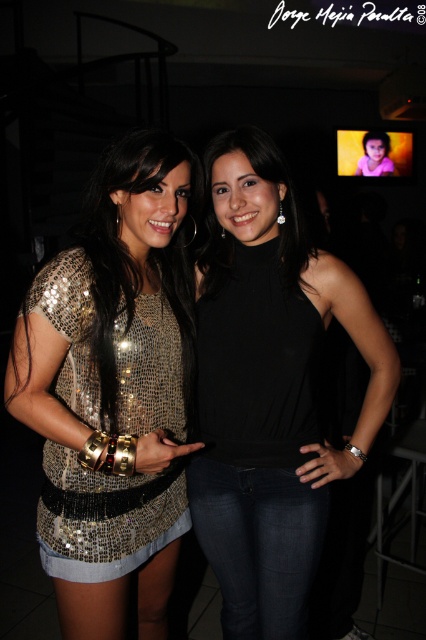
How distant is sequined metallic dress at left from sequined gold dress at center?

sequined metallic dress at left and sequined gold dress at center are 13.87 centimeters apart from each other.

Locate an element on the screen. The image size is (426, 640). sequined metallic dress at left is located at coordinates (104, 516).

Where is `sequined metallic dress at left`? This screenshot has width=426, height=640. sequined metallic dress at left is located at coordinates (104, 516).

Measure the distance between black matte tank top at center and camera.

black matte tank top at center is 4.15 feet away from camera.

Is the position of black matte tank top at center more distant than that of sequined metallic dress at left?

Yes, it is.

Is point (284, 205) closer to camera compared to point (43, 454)?

Yes, it is.

Find the location of a particular element. black matte tank top at center is located at coordinates (270, 388).

Can you confirm if black matte tank top at center is positioned to the left of sequined gold dress at center?

No, black matte tank top at center is not to the left of sequined gold dress at center.

Describe the element at coordinates (270, 388) in the screenshot. I see `black matte tank top at center` at that location.

Where is `black matte tank top at center`? black matte tank top at center is located at coordinates (270, 388).